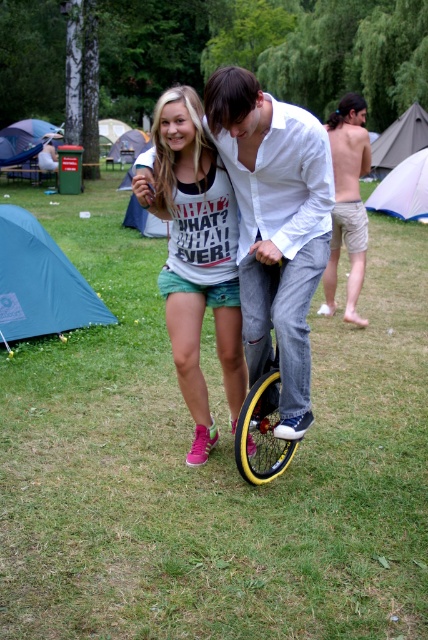
You are a photographer at the camping event. You want to take a photo of the white cotton shirt at center and the yellow rubber wheel at center. Which object should you focus on first if you want to capture both in the same frame without moving the camera?

The white cotton shirt at center is much taller than the yellow rubber wheel at center, so you should focus on the white cotton shirt at center first to ensure it is in focus before the yellow rubber wheel at center.

You are a photographer trying to capture the perfect shot of the yellow rubber monocycle at center. The camera you are using has a sensor that can only focus on objects within a 0.5 unit radius. Given that the monocycle is at coordinate point 0.661, 0.612, will your camera be able to focus on it?

The yellow rubber monocycle at center is located at point (261,422). Since the camera sensor can focus within a 0.5 unit radius, the monocycle is within range and the camera can focus on it.